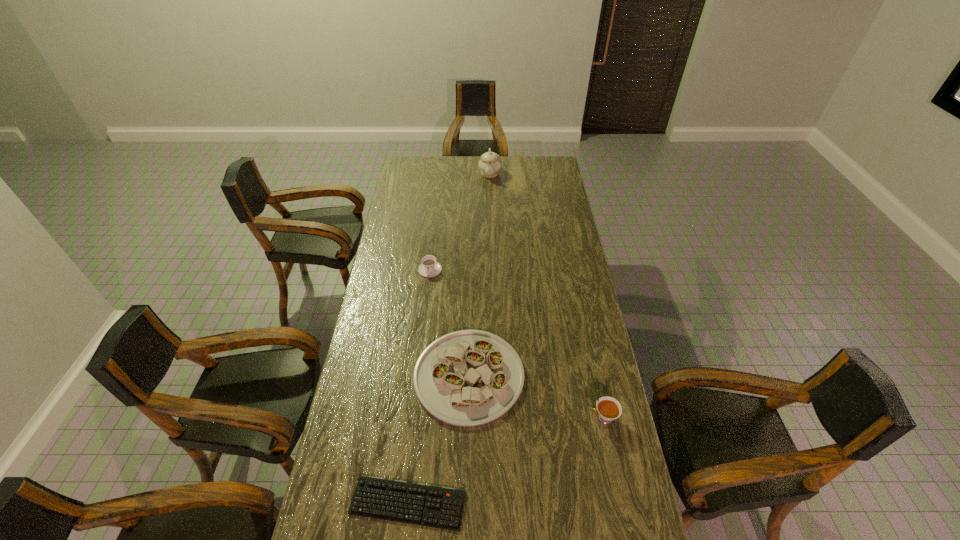
The height and width of the screenshot is (540, 960). What are the coordinates of `the tallest object` in the screenshot? It's located at (489, 164).

The width and height of the screenshot is (960, 540). In order to click on chinaware in this screenshot , I will do `click(489, 164)`.

Find the location of `the rightmost object`. the rightmost object is located at coordinates (608, 408).

Identify the location of the nearer teacup. (608, 408).

Identify the location of platter. (466, 378).

This screenshot has height=540, width=960. I want to click on the left teacup, so click(x=429, y=268).

Where is `the second farthest object`? the second farthest object is located at coordinates (429, 268).

Find the location of a particular element. computer keyboard is located at coordinates (441, 507).

Identify the location of the nearest object. (441, 507).

The height and width of the screenshot is (540, 960). Identify the location of free space located at the spout of the farthest object. (492, 225).